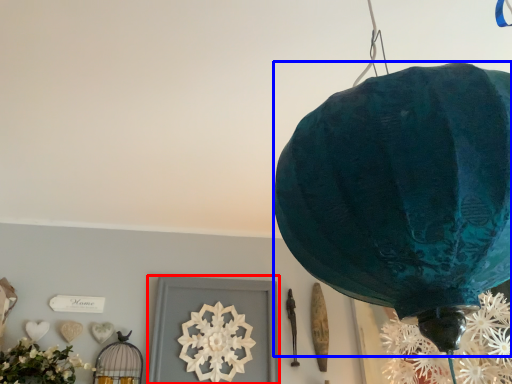
Question: Which object is further to the camera taking this photo, picture frame (highlighted by a red box) or lantern (highlighted by a blue box)?

Choices:
 (A) picture frame
 (B) lantern

Answer: (A)